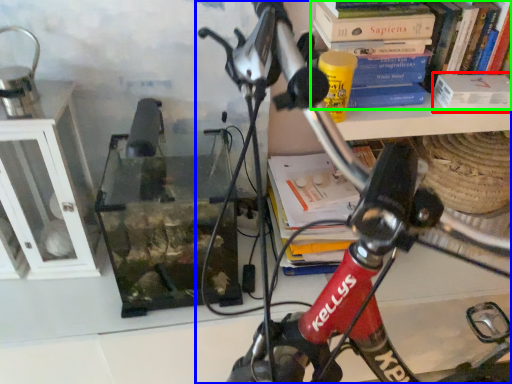
Question: Which is nearer to the paperback book (highlighted by a red box)? bicycle (highlighted by a blue box) or book (highlighted by a green box).

Choices:
 (A) bicycle
 (B) book

Answer: (B)